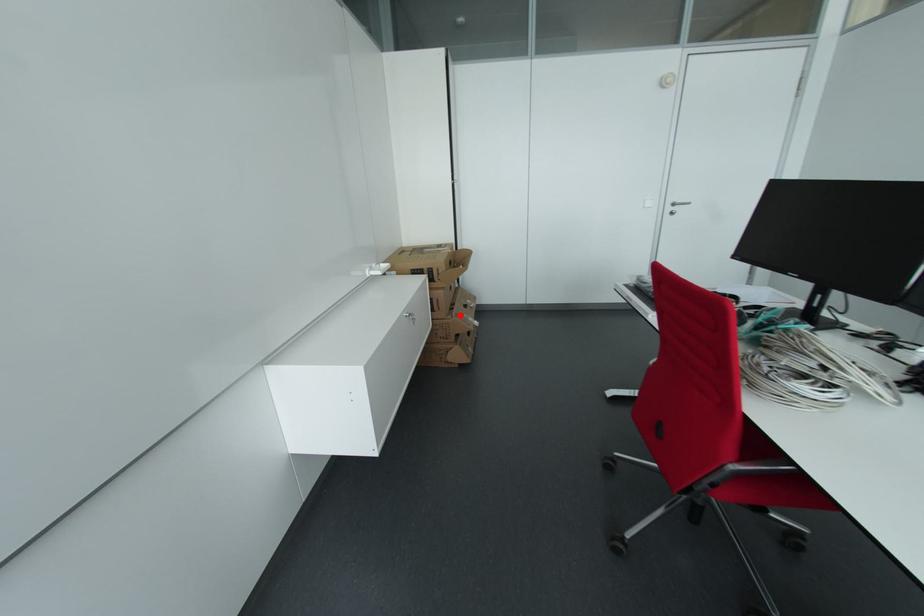
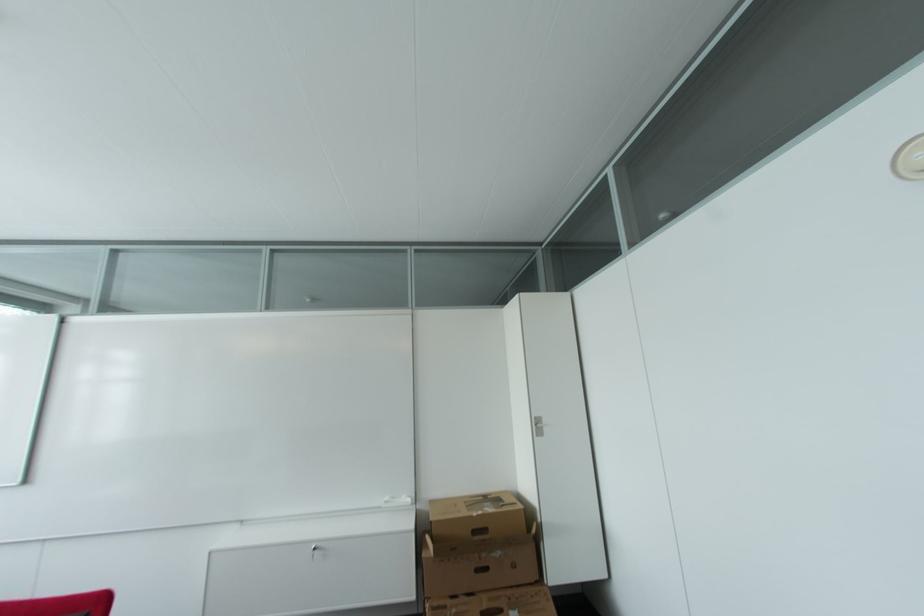
The point at the highlighted location is marked in the first image. Where is the corresponding point in the second image?

(448, 609)